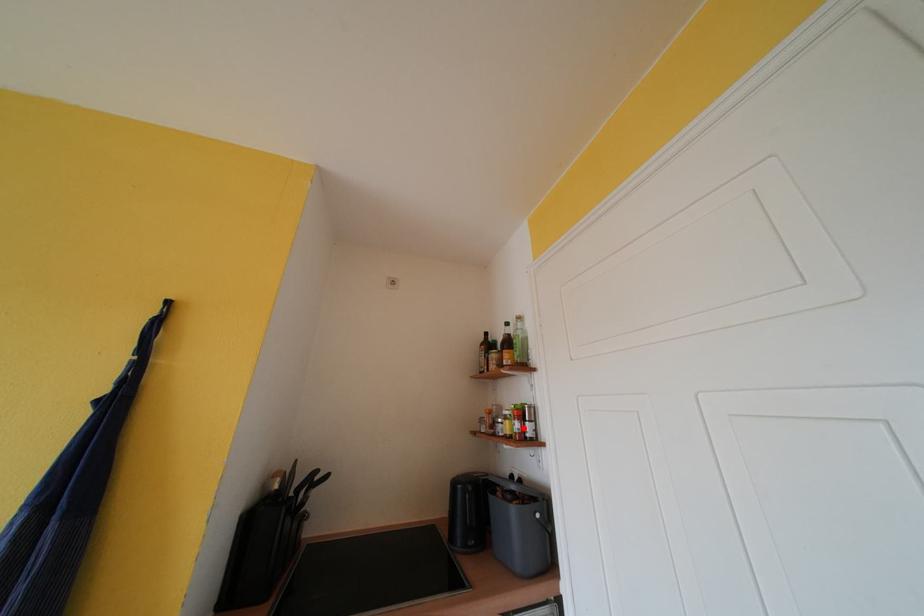
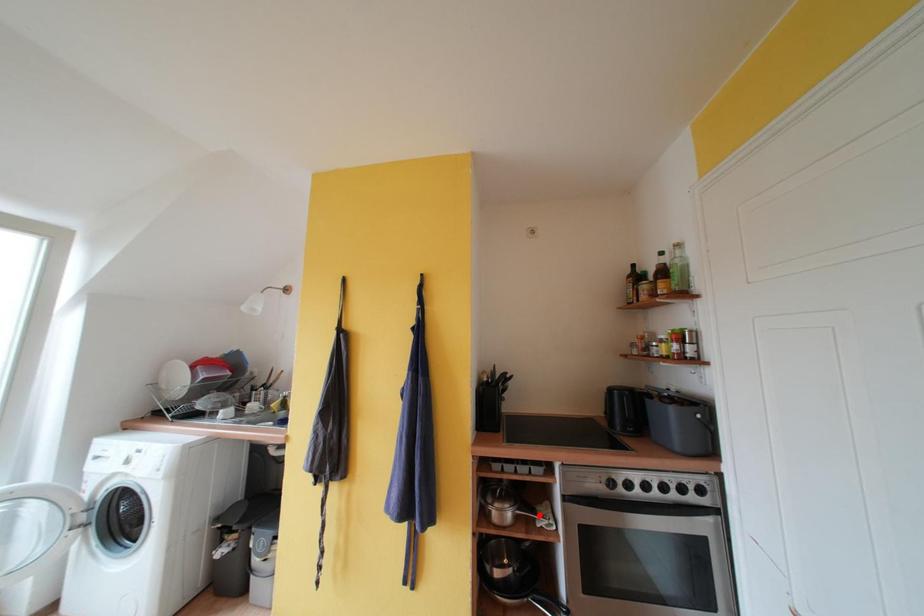
I am providing you with two images of the same scene from different viewpoints. A red point is marked on the first image and another point is marked on the second image. Is the red point in image1 aligned with the point shown in image2?

No